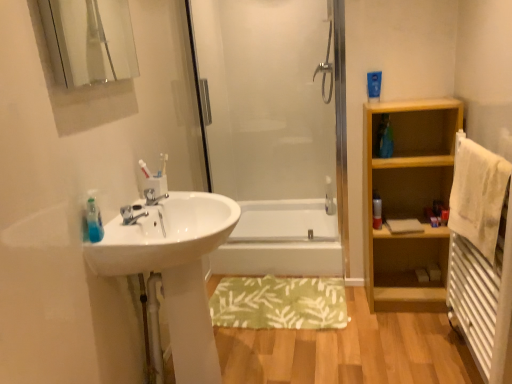
Identify the location of free space between light wood shelf at right and white textured radiator at right. This screenshot has width=512, height=384. (414, 337).